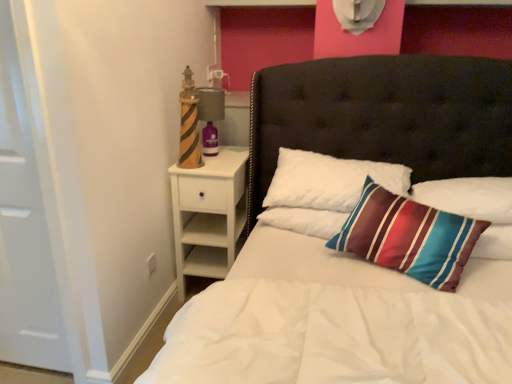
Question: Is white matte door at left a part of white quilted pillow at center, arranged as the 1th pillow when viewed from the left?

Choices:
 (A) yes
 (B) no

Answer: (B)

Question: Can you confirm if white quilted pillow at center, arranged as the 1th pillow when viewed from the left, is taller than white matte door at left?

Choices:
 (A) no
 (B) yes

Answer: (A)

Question: Is white quilted pillow at center, the second pillow in the right-to-left sequence, positioned in front of white matte door at left?

Choices:
 (A) no
 (B) yes

Answer: (A)

Question: Considering the relative sizes of white quilted pillow at center, arranged as the 1th pillow when viewed from the left, and white matte door at left in the image provided, is white quilted pillow at center, arranged as the 1th pillow when viewed from the left, thinner than white matte door at left?

Choices:
 (A) no
 (B) yes

Answer: (A)

Question: From the image's perspective, is white quilted pillow at center, arranged as the 1th pillow when viewed from the left, under white matte door at left?

Choices:
 (A) yes
 (B) no

Answer: (B)

Question: Does white quilted pillow at center, arranged as the 1th pillow when viewed from the left, have a greater width compared to white matte door at left?

Choices:
 (A) no
 (B) yes

Answer: (B)

Question: Does teal striped pillow at upper right, the 1th pillow from the right, have a lesser width compared to white matte door at left?

Choices:
 (A) no
 (B) yes

Answer: (A)

Question: Is teal striped pillow at upper right, the 1th pillow from the right, facing towards white matte door at left?

Choices:
 (A) no
 (B) yes

Answer: (A)

Question: Can you confirm if teal striped pillow at upper right, the second pillow when ordered from left to right, is positioned to the right of white matte door at left?

Choices:
 (A) no
 (B) yes

Answer: (B)

Question: Does teal striped pillow at upper right, the 1th pillow from the right, have a greater height compared to white matte door at left?

Choices:
 (A) yes
 (B) no

Answer: (B)

Question: Does teal striped pillow at upper right, the 1th pillow from the right, have a lesser height compared to white matte door at left?

Choices:
 (A) no
 (B) yes

Answer: (B)

Question: From a real-world perspective, is white quilted bed at center physically above white quilted pillow at center, the second pillow in the right-to-left sequence?

Choices:
 (A) yes
 (B) no

Answer: (A)